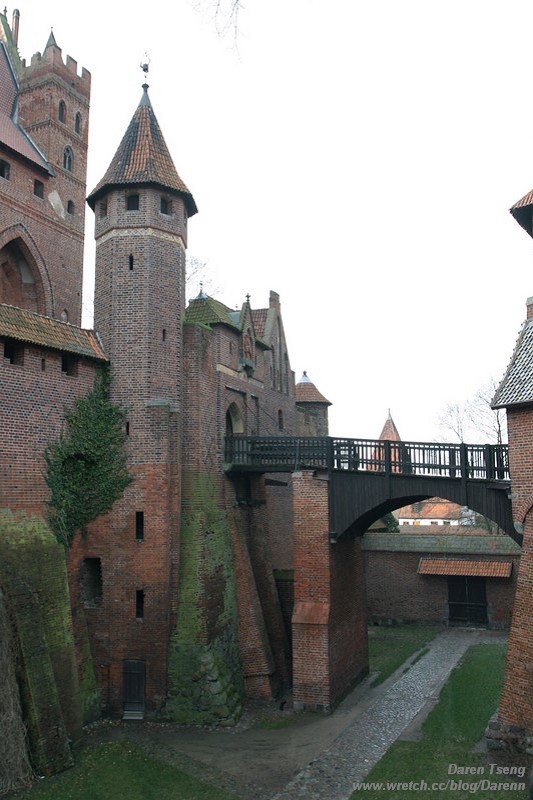
You are a GUI agent. You are given a task and a screenshot of the screen. Output one action in this format:
    pyautogui.click(x=<x>, y=<y>)
    Task: Click on the windows
    This screenshot has width=533, height=800.
    Given the screenshot: What is the action you would take?
    pyautogui.click(x=140, y=526), pyautogui.click(x=142, y=602)